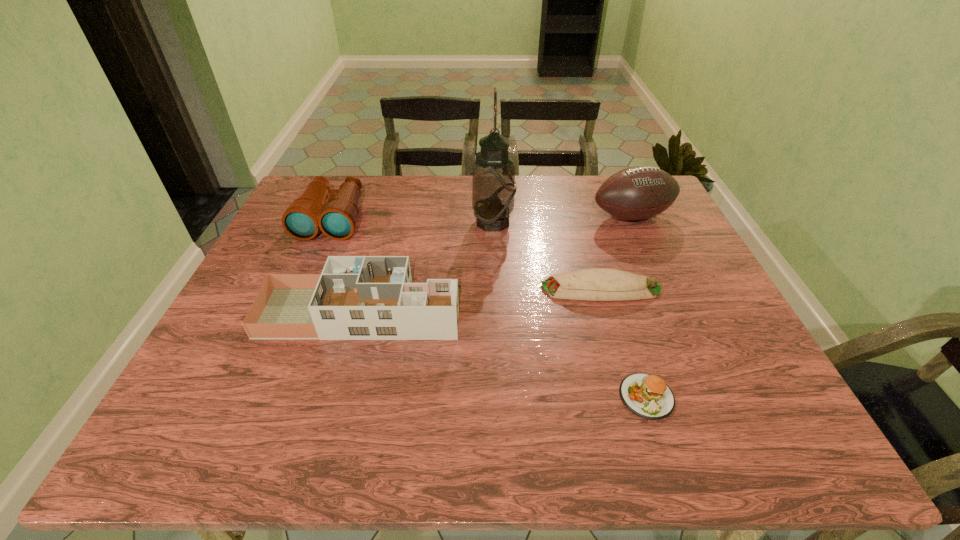
Where is `dollhouse positioned at the left edge`? dollhouse positioned at the left edge is located at coordinates (355, 297).

I want to click on football (American) present at the right edge, so click(x=640, y=192).

Identify the location of burrito at the right edge. The width and height of the screenshot is (960, 540). (594, 284).

The height and width of the screenshot is (540, 960). Find the location of `object present at the far left corner`. object present at the far left corner is located at coordinates (337, 219).

This screenshot has width=960, height=540. What are the coordinates of `object present at the far right corner` in the screenshot? It's located at (640, 192).

Find the location of a particular element. This screenshot has height=540, width=960. vacant space at the far edge of the desktop is located at coordinates (533, 210).

The height and width of the screenshot is (540, 960). In the image, there is a desktop. What are the coordinates of `vacant space at the near edge` in the screenshot? It's located at (710, 438).

This screenshot has height=540, width=960. What are the coordinates of `vacant space at the left edge of the desktop` in the screenshot? It's located at pyautogui.click(x=245, y=395).

Locate an element on the screen. free location at the right edge of the desktop is located at coordinates (668, 264).

Find the location of a particular element. free region at the near right corner of the desktop is located at coordinates (725, 417).